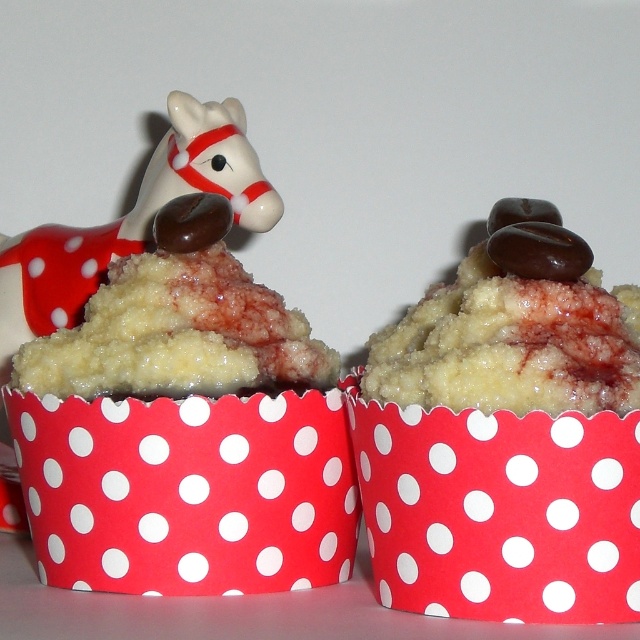
Which of these two, matte white cupcake at upper left or matte chocolate cupcake at center, stands shorter?

matte chocolate cupcake at center

The height and width of the screenshot is (640, 640). I want to click on matte white cupcake at upper left, so click(x=184, y=429).